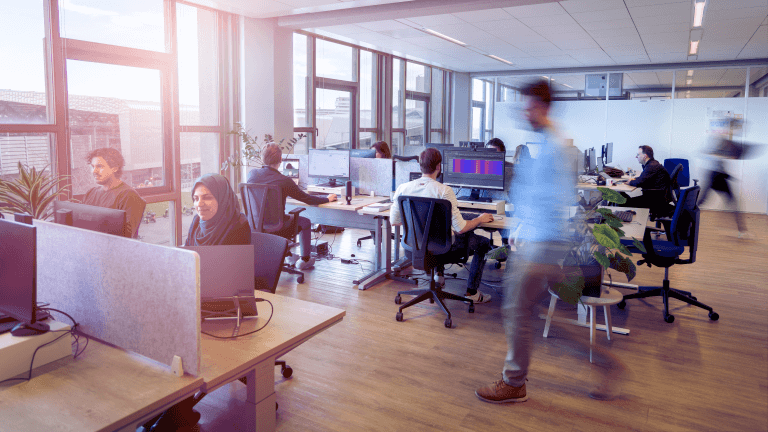
Identify the location of light. This screenshot has width=768, height=432. pyautogui.click(x=697, y=9), pyautogui.click(x=696, y=45), pyautogui.click(x=690, y=69), pyautogui.click(x=690, y=79), pyautogui.click(x=689, y=92), pyautogui.click(x=689, y=96), pyautogui.click(x=442, y=36), pyautogui.click(x=502, y=59), pyautogui.click(x=548, y=77), pyautogui.click(x=571, y=85).